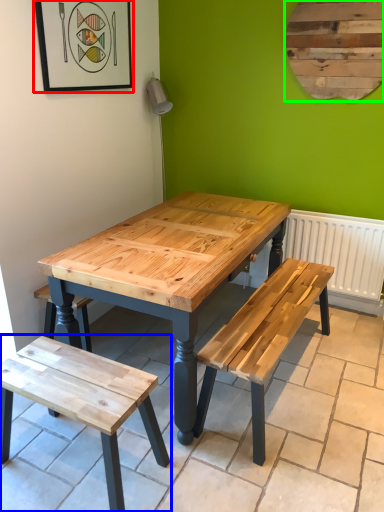
Question: Estimate the real-world distances between objects in this image. Which object is farther from picture frame (highlighted by a red box), bench (highlighted by a blue box) or bulletin board (highlighted by a green box)?

Choices:
 (A) bench
 (B) bulletin board

Answer: (A)